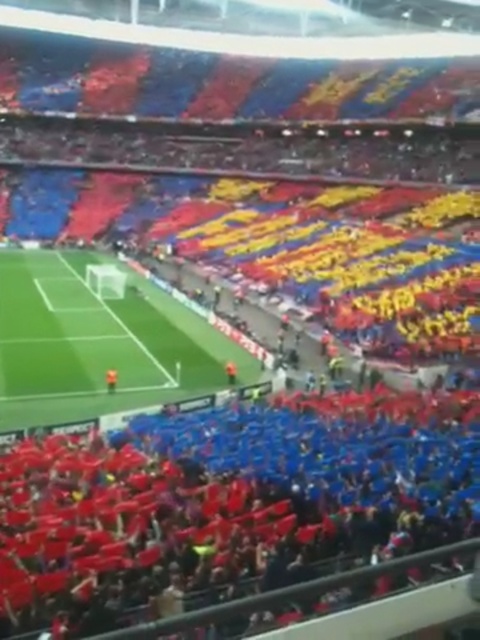
Question: Is red fabric crowd at lower center bigger than green grass football field at center?

Choices:
 (A) yes
 (B) no

Answer: (B)

Question: Which object is closer to the camera taking this photo?

Choices:
 (A) red fabric crowd at lower center
 (B) green grass football field at center

Answer: (A)

Question: Which point appears closest to the camera in this image?

Choices:
 (A) (121, 340)
 (B) (233, 536)

Answer: (B)

Question: Is red fabric crowd at lower center above green grass football field at center?

Choices:
 (A) yes
 (B) no

Answer: (B)

Question: Among these points, which one is farthest from the camera?

Choices:
 (A) pos(2,358)
 (B) pos(194,413)

Answer: (A)

Question: Does red fabric crowd at lower center appear on the right side of green grass football field at center?

Choices:
 (A) yes
 (B) no

Answer: (A)